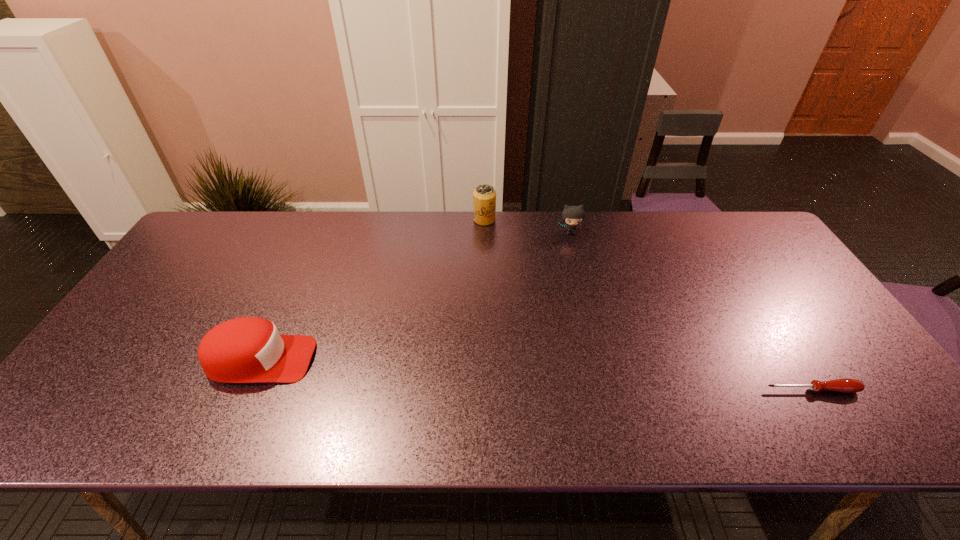
Where is `vacant area situated 0.170m on the left of the rightmost object`? Image resolution: width=960 pixels, height=540 pixels. vacant area situated 0.170m on the left of the rightmost object is located at coordinates (691, 390).

Where is `beer can present at the far edge`? The image size is (960, 540). beer can present at the far edge is located at coordinates click(x=484, y=196).

Where is `kitten that is positioned at the far edge`? This screenshot has width=960, height=540. kitten that is positioned at the far edge is located at coordinates (572, 215).

Locate an element on the screen. The width and height of the screenshot is (960, 540). object located at the right edge is located at coordinates (844, 385).

Identify the location of blank space at the far edge of the desktop. This screenshot has height=540, width=960. (390, 245).

At what (x,y) coordinates should I click in order to perform the action: click on free location at the near edge. Please return your answer as a coordinate pair (x, y). The height and width of the screenshot is (540, 960). Looking at the image, I should click on (410, 427).

This screenshot has width=960, height=540. Identify the location of free space at the left edge of the desktop. (101, 375).

Identify the location of vacant space at the right edge of the desktop. (754, 279).

At what (x,y) coordinates should I click in order to perform the action: click on vacant space at the far left corner of the desktop. Please return your answer as a coordinate pair (x, y). The image size is (960, 540). Looking at the image, I should click on (239, 240).

Image resolution: width=960 pixels, height=540 pixels. Identify the location of vacant space at the near left corner of the desktop. (129, 403).